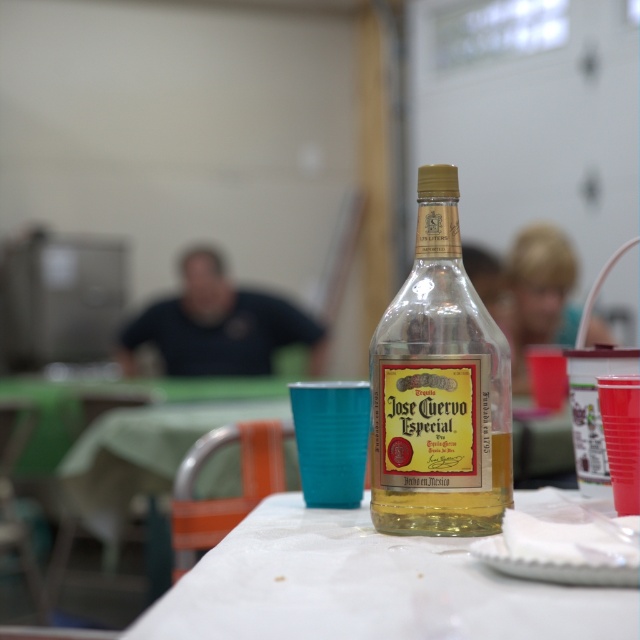
Question: Does transparent glass bottle at center have a greater width compared to blonde hair at upper right?

Choices:
 (A) no
 (B) yes

Answer: (A)

Question: Estimate the real-world distances between objects in this image. Which object is farther from the black shirt at center?

Choices:
 (A) blonde hair at upper right
 (B) white paper napkin at center
 (C) clear glass bottle at center
 (D) transparent glass bottle at center

Answer: (C)

Question: Is transparent glass bottle at center above blonde hair at upper right?

Choices:
 (A) no
 (B) yes

Answer: (A)

Question: Can you confirm if black shirt at center is positioned to the right of blonde hair at upper right?

Choices:
 (A) no
 (B) yes

Answer: (A)

Question: Which of the following is the closest to the observer?

Choices:
 (A) transparent glass bottle at center
 (B) black shirt at center

Answer: (A)

Question: Which point appears closest to the camera in this image?

Choices:
 (A) (428, 164)
 (B) (516, 276)
 (C) (358, 564)

Answer: (C)